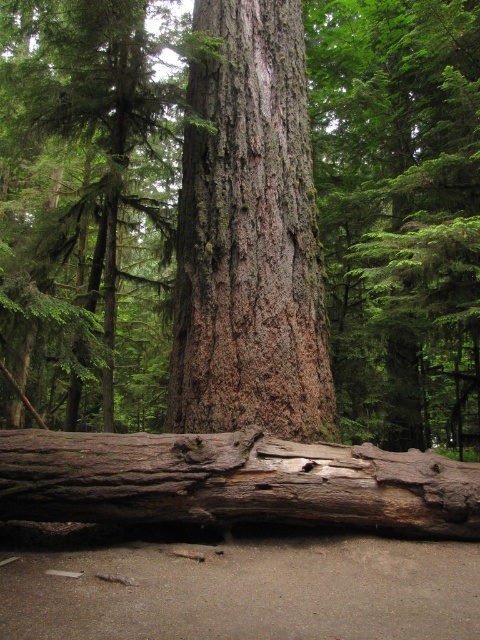
Based on the photo, does smooth brown bark at center have a larger size compared to rough bark tree trunk at center?

Correct, smooth brown bark at center is larger in size than rough bark tree trunk at center.

Between point (465, 100) and point (259, 246), which one is positioned behind?

Positioned behind is point (465, 100).

Image resolution: width=480 pixels, height=640 pixels. Find the location of `smooth brown bark at center`. smooth brown bark at center is located at coordinates (96, 200).

Does smooth brown bark at center appear over rough bark log at lower center?

Yes.

Between point (351, 182) and point (208, 518), which one is positioned behind?

Point (351, 182)

Image resolution: width=480 pixels, height=640 pixels. I want to click on smooth brown bark at center, so click(96, 200).

Can you confirm if rough bark tree trunk at center is wider than rough bark log at lower center?

In fact, rough bark tree trunk at center might be narrower than rough bark log at lower center.

Can you confirm if rough bark tree trunk at center is positioned to the right of rough bark log at lower center?

Indeed, rough bark tree trunk at center is positioned on the right side of rough bark log at lower center.

Is point (276, 328) in front of point (279, 452)?

No, (276, 328) is further to viewer.

Locate an element on the screen. The width and height of the screenshot is (480, 640). rough bark tree trunk at center is located at coordinates (249, 236).